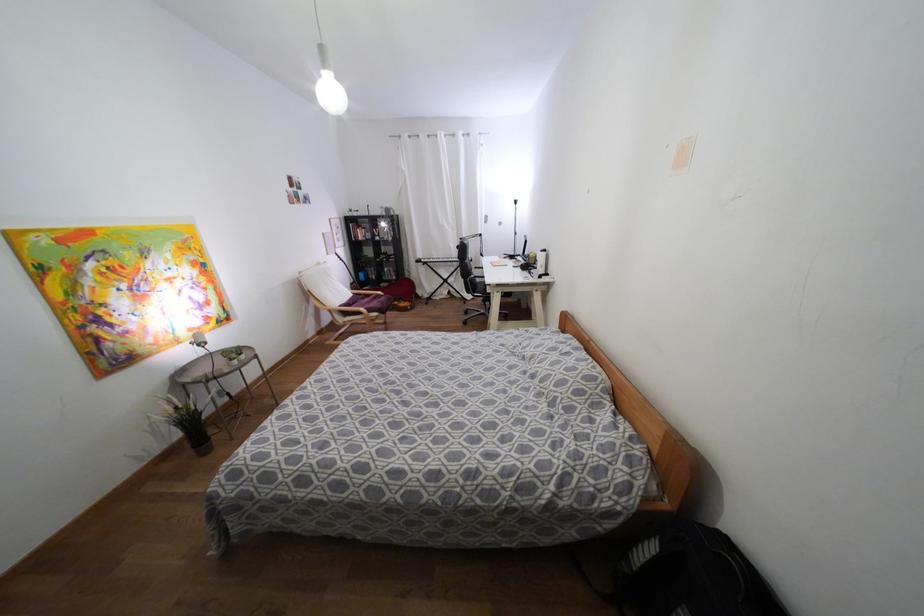
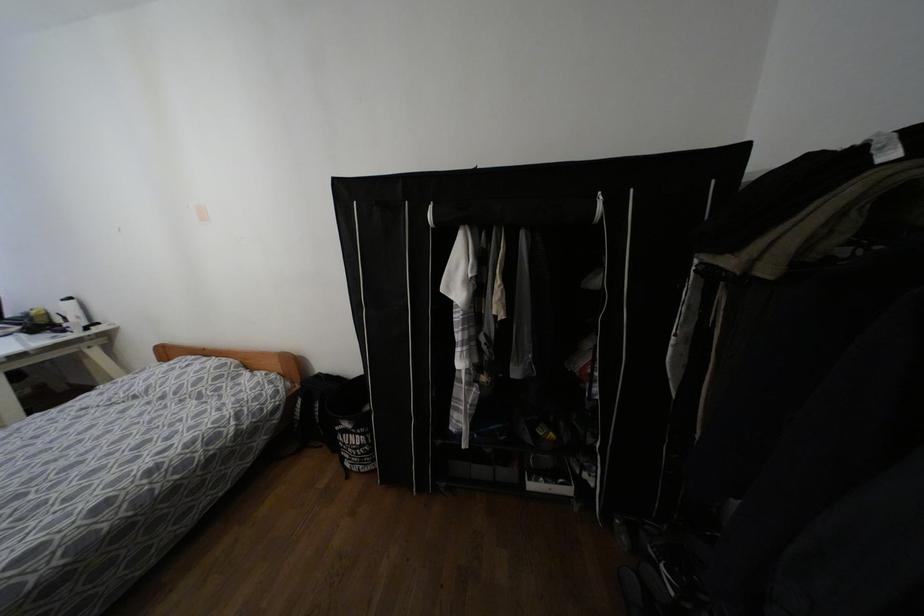
Find the pixel in the second image that matches the point at 543,249 in the first image.

(68, 299)